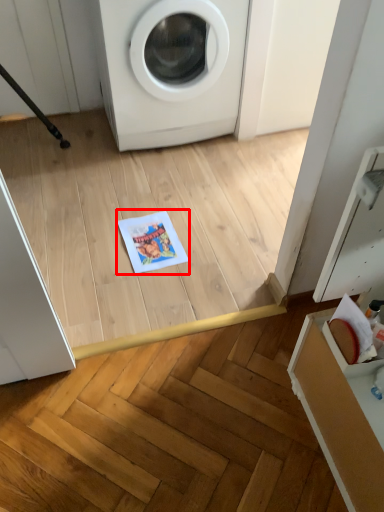
Question: From the image's perspective, what is the correct spatial positioning of copy (annotated by the red box) in reference to washing machine?

Choices:
 (A) above
 (B) below

Answer: (B)